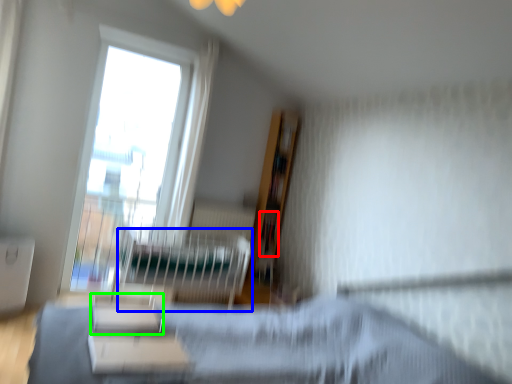
Question: Which object is positioned closest to book (highlighted by a red box)? Select from hospital bed (highlighted by a blue box) and furniture (highlighted by a green box).

Choices:
 (A) hospital bed
 (B) furniture

Answer: (A)